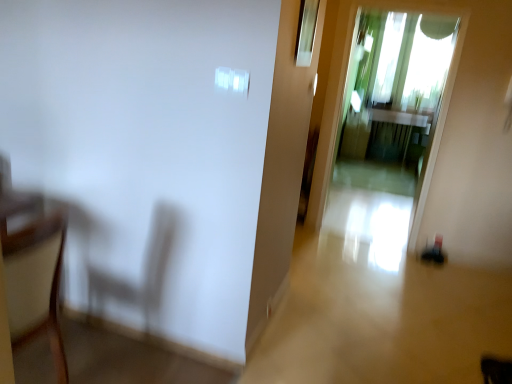
Question: Is wooden armchair at left smaller than transparent glass window at upper center?

Choices:
 (A) no
 (B) yes

Answer: (A)

Question: From the image's perspective, is wooden armchair at left beneath transparent glass window at upper center?

Choices:
 (A) no
 (B) yes

Answer: (B)

Question: Does wooden armchair at left have a lesser height compared to transparent glass window at upper center?

Choices:
 (A) yes
 (B) no

Answer: (B)

Question: From the image's perspective, is wooden armchair at left on top of transparent glass window at upper center?

Choices:
 (A) yes
 (B) no

Answer: (B)

Question: Is wooden armchair at left facing towards transparent glass window at upper center?

Choices:
 (A) no
 (B) yes

Answer: (A)

Question: Does wooden armchair at left come in front of transparent glass window at upper center?

Choices:
 (A) yes
 (B) no

Answer: (A)

Question: Can you confirm if transparent glass window at upper center is bigger than transparent glass screen door at center?

Choices:
 (A) yes
 (B) no

Answer: (B)

Question: Is transparent glass window at upper center behind transparent glass screen door at center?

Choices:
 (A) no
 (B) yes

Answer: (A)

Question: Is transparent glass window at upper center in contact with transparent glass screen door at center?

Choices:
 (A) yes
 (B) no

Answer: (B)

Question: Can you confirm if transparent glass window at upper center is shorter than transparent glass screen door at center?

Choices:
 (A) no
 (B) yes

Answer: (B)

Question: Is transparent glass window at upper center closer to the viewer compared to transparent glass screen door at center?

Choices:
 (A) yes
 (B) no

Answer: (A)

Question: Does transparent glass window at upper center have a greater width compared to transparent glass screen door at center?

Choices:
 (A) yes
 (B) no

Answer: (B)

Question: Considering the relative sizes of transparent glass window at upper center and wooden armchair at left in the image provided, is transparent glass window at upper center taller than wooden armchair at left?

Choices:
 (A) yes
 (B) no

Answer: (B)